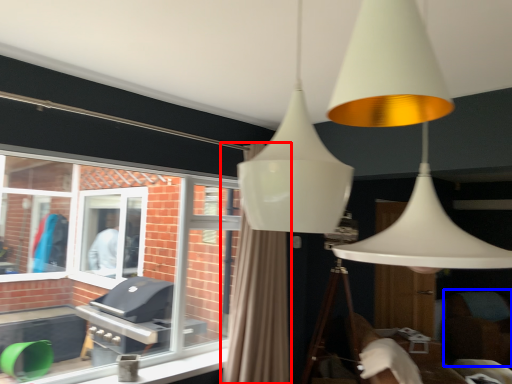
Question: Which object appears farthest to the camera in this image, curtain (highlighted by a red box) or swivel chair (highlighted by a blue box)?

Choices:
 (A) curtain
 (B) swivel chair

Answer: (B)